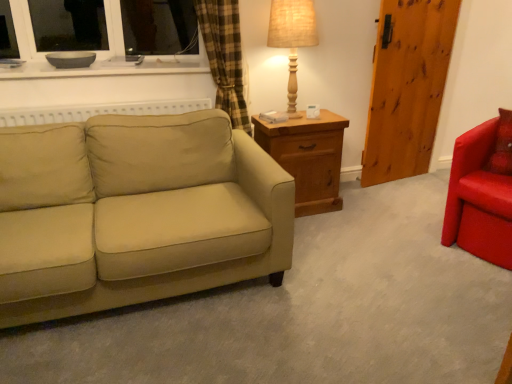
You are a GUI agent. You are given a task and a screenshot of the screen. Output one action in this format:
    pyautogui.click(x=<x>, y=<y>)
    Task: Click on the vacant area that lies to the right of wooden nightstand at center
    
    Given the screenshot: What is the action you would take?
    pyautogui.click(x=357, y=205)